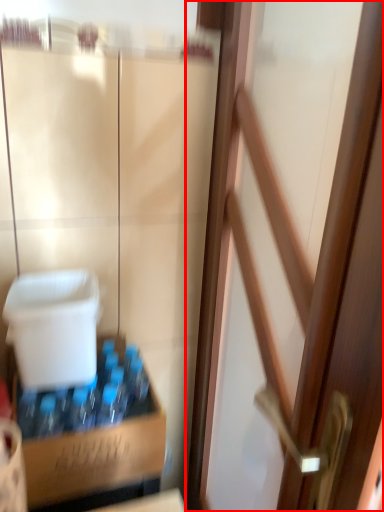
Question: From the image's perspective, what is the correct spatial relationship of door (annotated by the red box) in relation to cardboard box?

Choices:
 (A) above
 (B) below

Answer: (A)